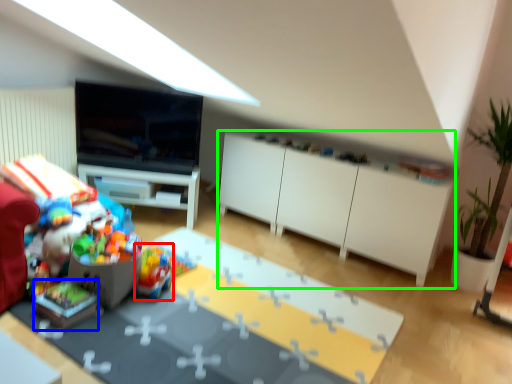
Question: Considering the real-world distances, which object is farthest from toy (highlighted by a red box)? toy (highlighted by a blue box) or cabinetry (highlighted by a green box)?

Choices:
 (A) toy
 (B) cabinetry

Answer: (B)